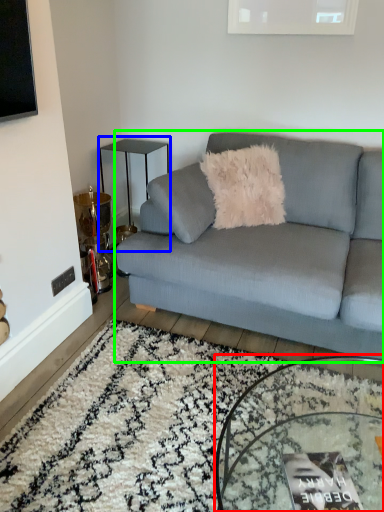
Question: Estimate the real-world distances between objects in this image. Which object is closer to coffee table (highlighted by a red box), table (highlighted by a blue box) or studio couch (highlighted by a green box)?

Choices:
 (A) table
 (B) studio couch

Answer: (B)